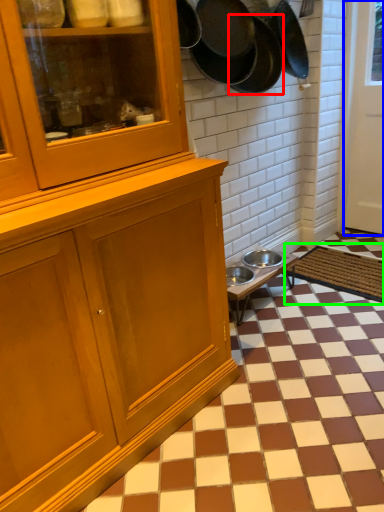
Question: Which object is positioned farthest from frying pan (highlighted by a red box)? Select from door (highlighted by a blue box) and doormat (highlighted by a green box).

Choices:
 (A) door
 (B) doormat

Answer: (B)